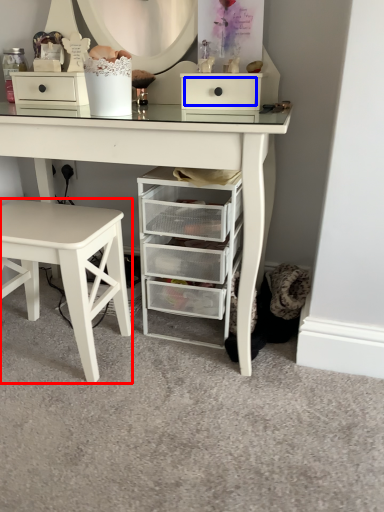
Question: Among these objects, which one is farthest to the camera, stool (highlighted by a red box) or drawer (highlighted by a blue box)?

Choices:
 (A) stool
 (B) drawer

Answer: (B)